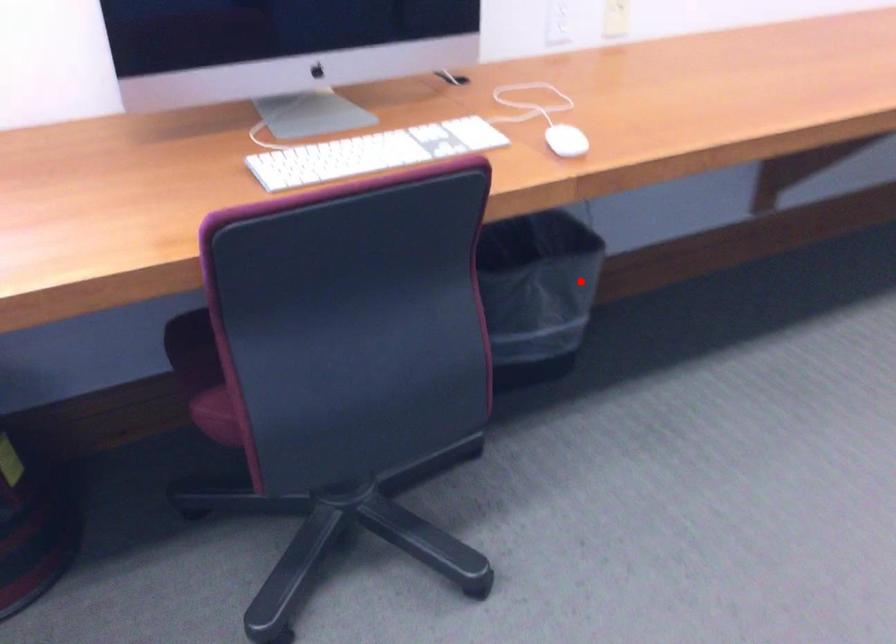
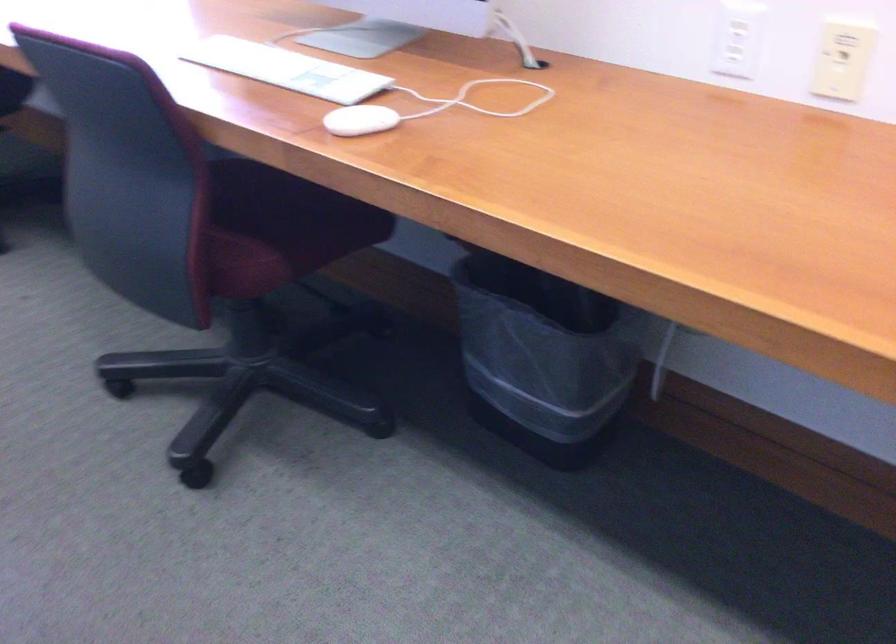
Where in the second image is the point corresponding to the highlighted location from the first image?

(543, 357)